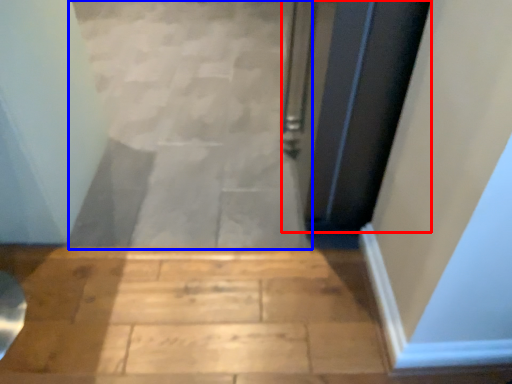
Question: Which object appears farthest to the camera in this image, door (highlighted by a red box) or stairwell (highlighted by a blue box)?

Choices:
 (A) door
 (B) stairwell

Answer: (B)